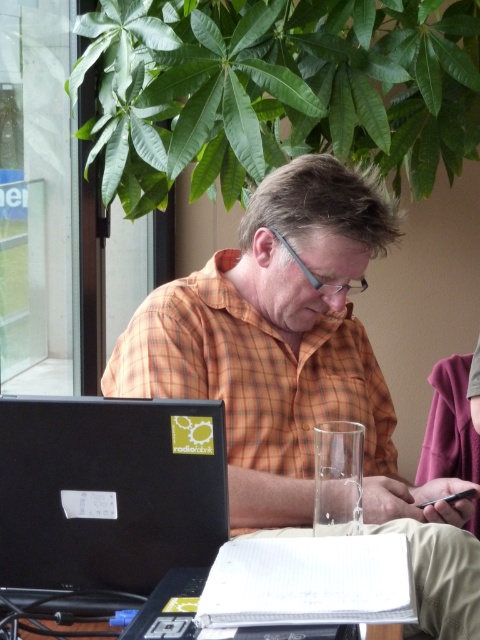
Question: Which point appears farthest from the camera in this image?

Choices:
 (A) (371, 580)
 (B) (83, 464)
 (C) (301, 304)
 (D) (122, 595)

Answer: (C)

Question: Where is orange checkered shirt at center located in relation to black matte laptop at lower left in the image?

Choices:
 (A) right
 (B) left

Answer: (A)

Question: Does white textured notebook at center come in front of white paper at lower center?

Choices:
 (A) no
 (B) yes

Answer: (B)

Question: Based on their relative distances, which object is nearer to the white paper at lower center?

Choices:
 (A) black matte laptop at lower left
 (B) white textured notebook at center
 (C) orange checkered shirt at center

Answer: (B)

Question: Which of the following is the closest to the observer?

Choices:
 (A) black matte laptop at lower left
 (B) orange checkered shirt at center

Answer: (A)

Question: Is black matte laptop at lower left positioned at the back of white paper at lower center?

Choices:
 (A) no
 (B) yes

Answer: (B)